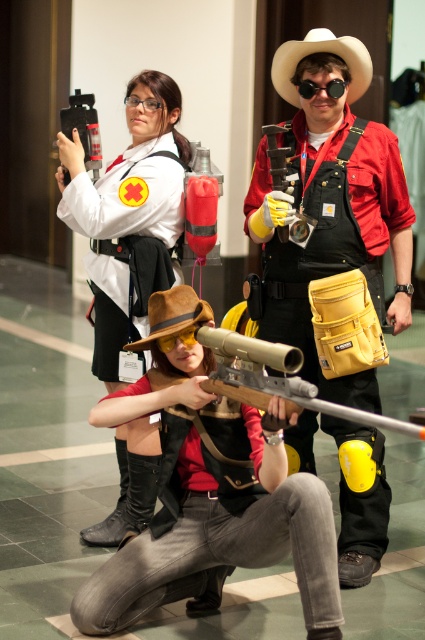
You are a photographer standing at the camera position. You want to take a photo of the matte white shirt at upper left. Can you reach it with your 2.5 meter long selfie stick?

The matte white shirt at upper left is 3.78 meters away from the camera, which is further than the 2.5 meter selfie stick. You cannot reach it.